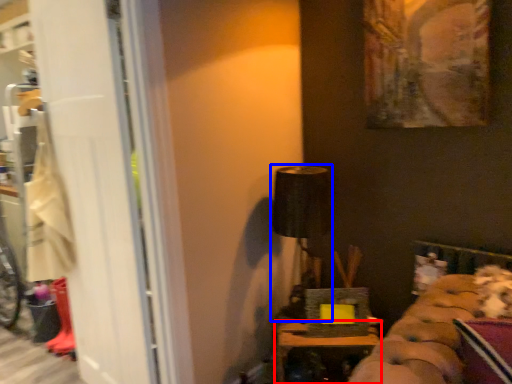
Question: Which point is closer to the camera, furniture (highlighted by a red box) or lamp (highlighted by a blue box)?

Choices:
 (A) furniture
 (B) lamp

Answer: (A)